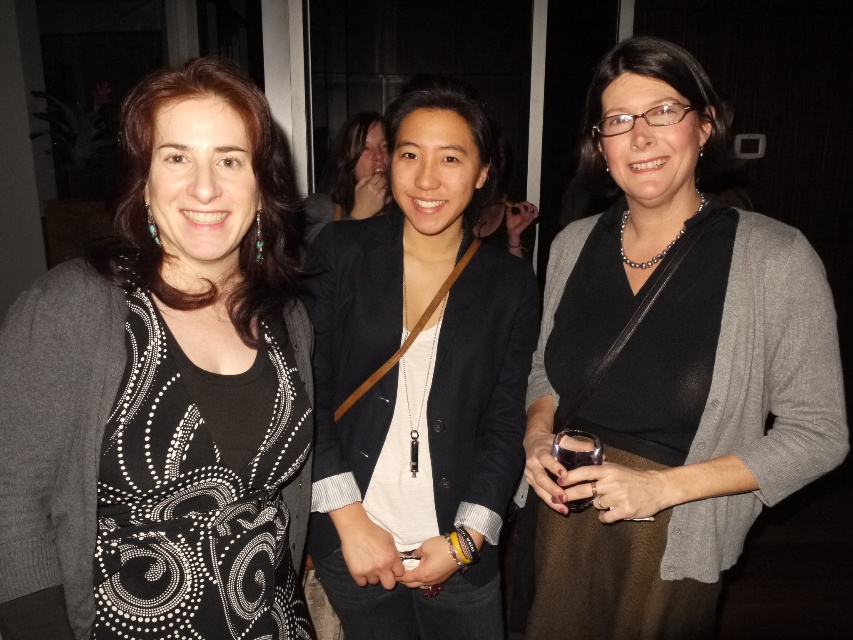
Question: In this image, where is black matte sweater at center located relative to matte black blazer at center?

Choices:
 (A) above
 (B) below

Answer: (B)

Question: Is black matte blazer at center wider than matte black blazer at center?

Choices:
 (A) no
 (B) yes

Answer: (B)

Question: Does black matte sweater at center appear over matte black blazer at center?

Choices:
 (A) yes
 (B) no

Answer: (B)

Question: Estimate the real-world distances between objects in this image. Which object is farther from the black matte blazer at center?

Choices:
 (A) matte black blazer at center
 (B) black matte sweater at center

Answer: (A)

Question: Which object is positioned closest to the matte black blazer at center?

Choices:
 (A) black matte sweater at center
 (B) black matte dress at center

Answer: (A)

Question: Considering the real-world distances, which object is farthest from the matte black blazer at center?

Choices:
 (A) black matte sweater at center
 (B) black matte blazer at center
 (C) black matte dress at center

Answer: (C)